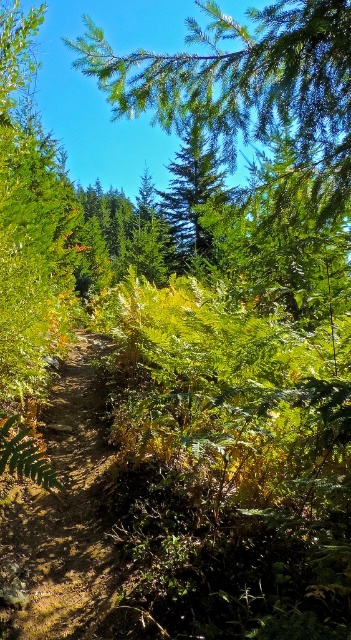
The width and height of the screenshot is (351, 640). Find the location of `green needle-like leaves at upper center`. green needle-like leaves at upper center is located at coordinates (247, 83).

Who is higher up, green needle-like leaves at upper center or green matte tree at upper center?

Positioned higher is green matte tree at upper center.

In order to click on green needle-like leaves at upper center in this screenshot , I will do `click(247, 83)`.

Locate an element on the screen. The height and width of the screenshot is (640, 351). green needle-like leaves at upper center is located at coordinates (247, 83).

In the scene shown: Which is above, green needle-like leaves at upper center or dirt path at center?

green needle-like leaves at upper center is higher up.

Which is behind, point (141, 60) or point (70, 400)?

The point (70, 400) is more distant.

Identify the location of green needle-like leaves at upper center. This screenshot has height=640, width=351. (247, 83).

Is dirt path at center to the left of green matte tree at upper center from the viewer's perspective?

Indeed, dirt path at center is positioned on the left side of green matte tree at upper center.

What do you see at coordinates (62, 516) in the screenshot?
I see `dirt path at center` at bounding box center [62, 516].

Image resolution: width=351 pixels, height=640 pixels. I want to click on dirt path at center, so click(x=62, y=516).